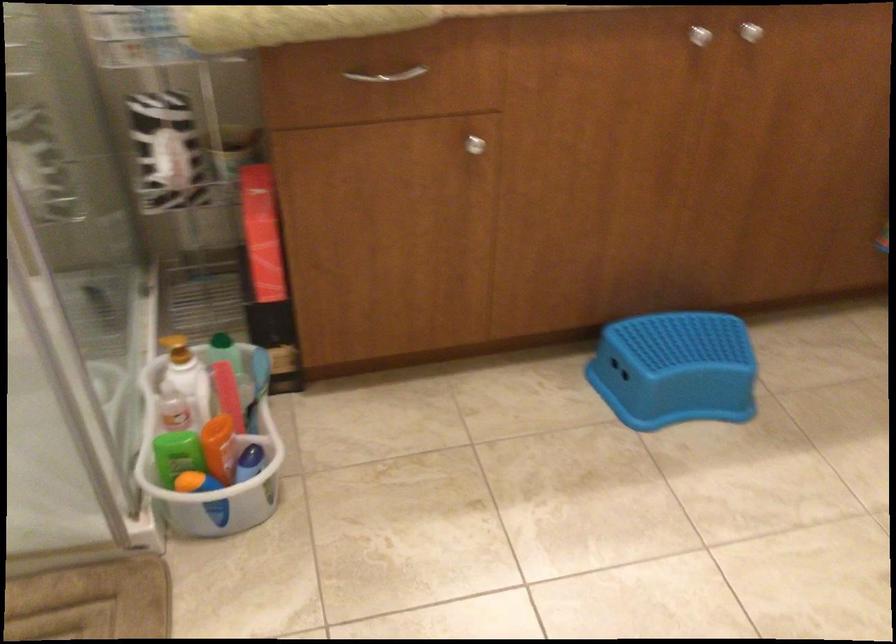
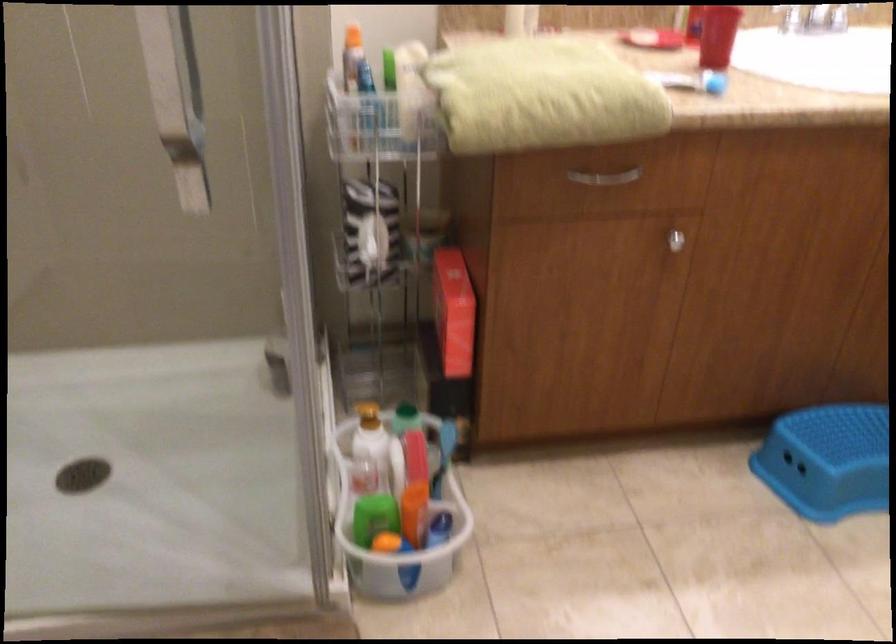
Question: The images are taken continuously from a first-person perspective. In which direction is your viewpoint rotating?

Choices:
 (A) Left
 (B) Right
 (C) Up
 (D) Down

Answer: (C)